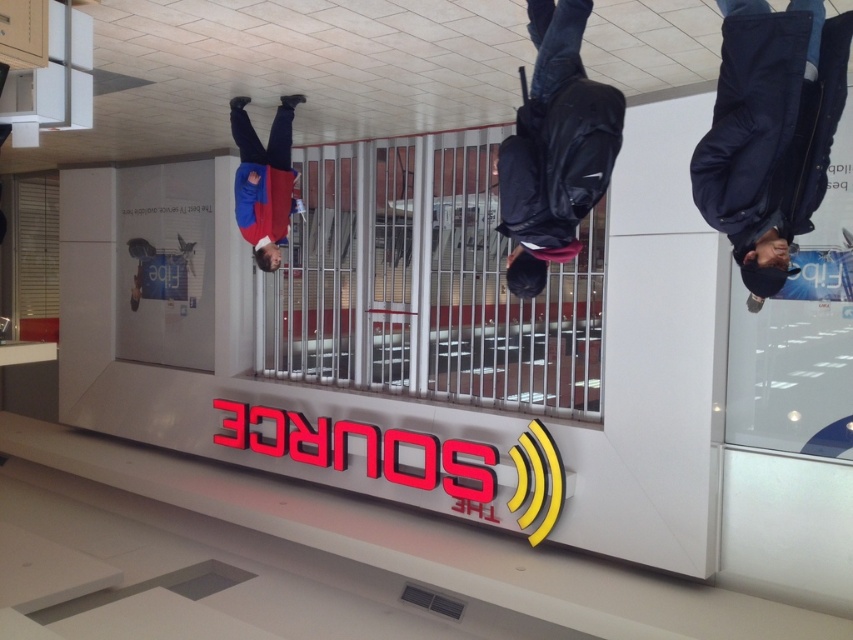
Question: Observing the image, what is the correct spatial positioning of dark blue jacket at center in reference to blue fabric jacket at upper center?

Choices:
 (A) above
 (B) below

Answer: (B)

Question: In this image, where is dark blue jacket at center located relative to dark blue backpack at center?

Choices:
 (A) below
 (B) above

Answer: (A)

Question: Which of the following is the closest to the observer?

Choices:
 (A) (287, 177)
 (B) (514, 154)
 (C) (779, 240)

Answer: (C)

Question: Which object is farther from the camera taking this photo?

Choices:
 (A) blue fabric jacket at upper center
 (B) dark blue jacket at center
 (C) dark blue backpack at center

Answer: (A)

Question: Among these objects, which one is farthest from the camera?

Choices:
 (A) dark blue jacket at center
 (B) blue fabric jacket at upper center
 (C) dark blue backpack at center

Answer: (B)

Question: Can you confirm if dark blue jacket at center is positioned below blue fabric jacket at upper center?

Choices:
 (A) yes
 (B) no

Answer: (A)